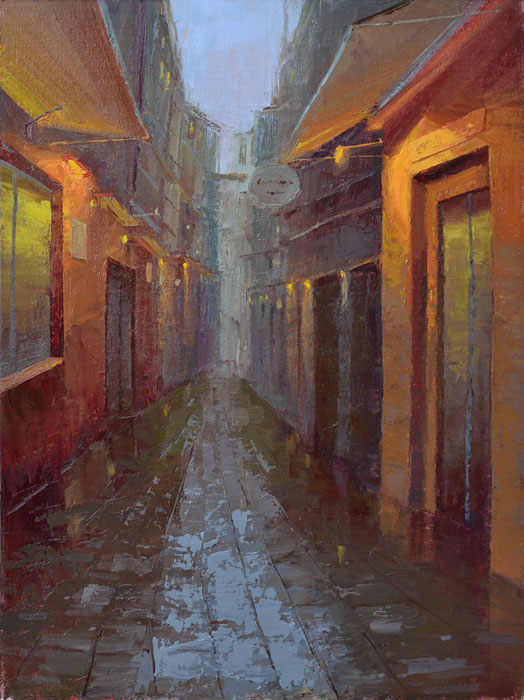
The height and width of the screenshot is (700, 524). What are the coordinates of `light` in the screenshot? It's located at (126, 239), (163, 262), (187, 265), (342, 150), (341, 272), (307, 281), (290, 283).